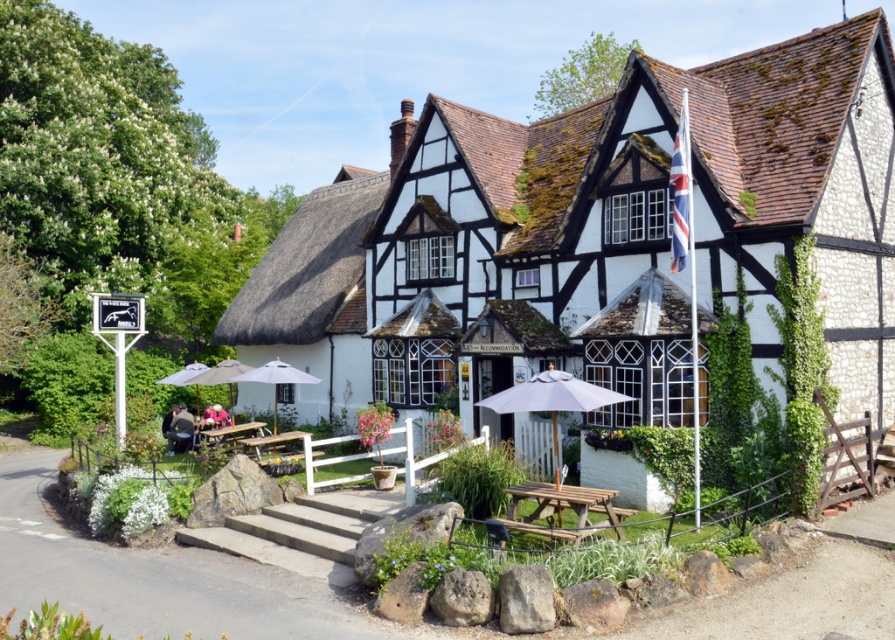
You are standing at the entrance of the traditional English building and want to sit down at the wooden picnic table at lower center. Which direction should you walk to reach it?

The wooden picnic table at lower center is located at point (561, 508), so you should walk forward and to the right to reach it.

You are a tourist visiting the traditional English building and want to sit under the matte white umbrella at center to enjoy the view. However, you notice the wooden picnic table at lower left. Is the picnic table located behind or in front of the umbrella?

The wooden picnic table at lower left is behind the matte white umbrella at center, so it is located behind the umbrella.

You are standing in front of the traditional English building and want to take a photo of the point at coordinates (251, 428). If your camera has a maximum focus range of 30 meters, will it be able to focus on that point?

The point at coordinates (251, 428) is 31.57 meters away from the camera, which exceeds the maximum focus range of 30 meters. Therefore, the camera will not be able to focus on that point.